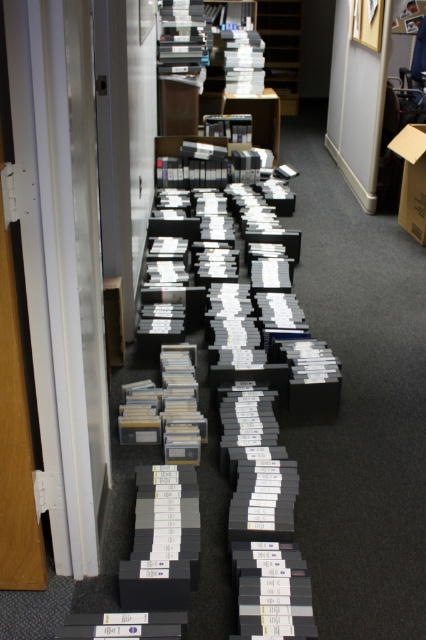
Question: Is matte black bookshelf at upper center further to the viewer compared to cardboard box at center-right?

Choices:
 (A) yes
 (B) no

Answer: (A)

Question: Among these objects, which one is farthest from the camera?

Choices:
 (A) matte black bookshelf at upper center
 (B) cardboard box at center-right

Answer: (A)

Question: Among these points, which one is nearest to the camera?

Choices:
 (A) (408, 205)
 (B) (281, 80)

Answer: (A)

Question: Which of the following is the farthest from the observer?

Choices:
 (A) matte black bookshelf at upper center
 (B) cardboard box at center-right

Answer: (A)

Question: Is matte black bookshelf at upper center to the left of cardboard box at center-right from the viewer's perspective?

Choices:
 (A) no
 (B) yes

Answer: (B)

Question: Does matte black bookshelf at upper center appear under cardboard box at center-right?

Choices:
 (A) no
 (B) yes

Answer: (A)